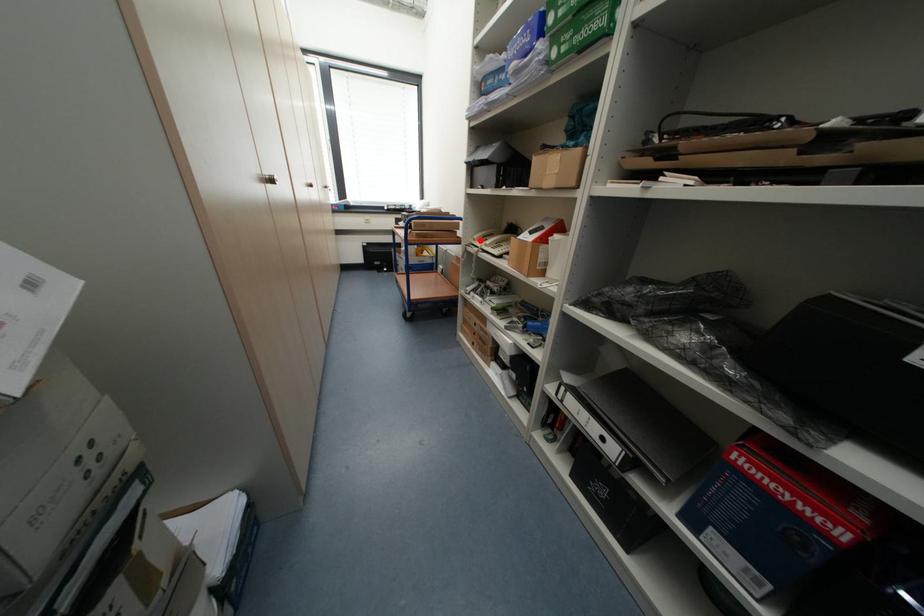
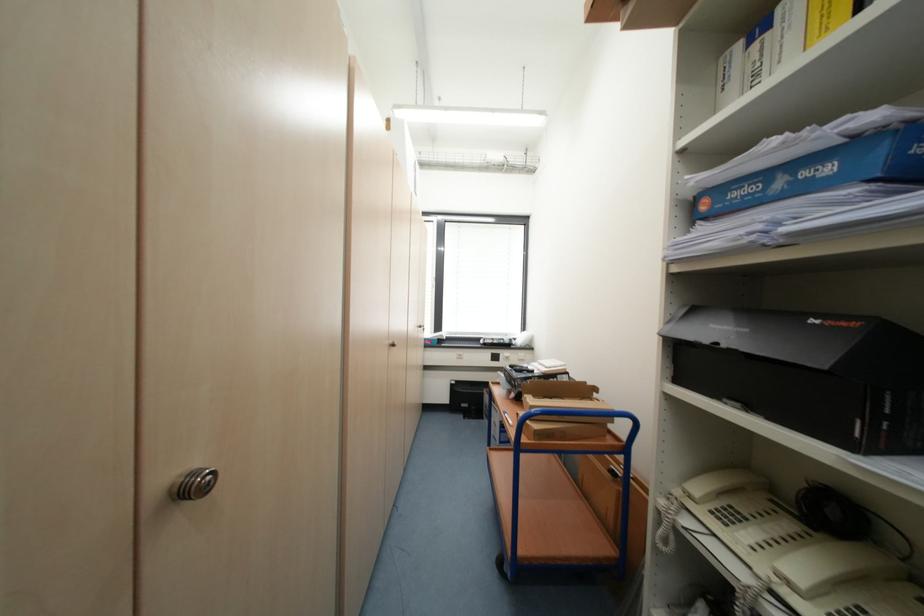
Where in the second image is the point corresponding to the highlighted location from the first image?

(697, 498)